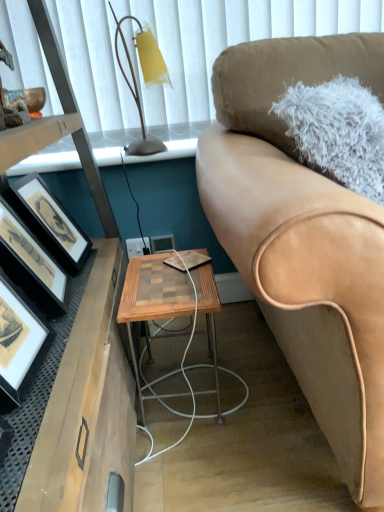
Question: Should I look upward or downward to see woodenmaterial/texturetable at center?

Choices:
 (A) down
 (B) up

Answer: (A)

Question: Should I look upward or downward to see matte black picture frame at left, which appears as the first picture frame when viewed from the left?

Choices:
 (A) down
 (B) up

Answer: (B)

Question: Is tan leather couch at right a part of wooden desk at left?

Choices:
 (A) yes
 (B) no

Answer: (B)

Question: Could you tell me if wooden desk at left is facing tan leather couch at right?

Choices:
 (A) no
 (B) yes

Answer: (B)

Question: Considering the relative positions of wooden desk at left and tan leather couch at right in the image provided, is wooden desk at left to the right of tan leather couch at right from the viewer's perspective?

Choices:
 (A) yes
 (B) no

Answer: (B)

Question: From a real-world perspective, is wooden desk at left physically above tan leather couch at right?

Choices:
 (A) yes
 (B) no

Answer: (B)

Question: Considering the relative sizes of wooden desk at left and tan leather couch at right in the image provided, is wooden desk at left smaller than tan leather couch at right?

Choices:
 (A) no
 (B) yes

Answer: (A)

Question: From the image's perspective, does wooden desk at left appear lower than tan leather couch at right?

Choices:
 (A) no
 (B) yes

Answer: (B)

Question: Is matte yellow glass at upper left wider than matte black picture frame at left, positioned as the second picture frame in right-to-left order?

Choices:
 (A) no
 (B) yes

Answer: (B)

Question: Considering the relative sizes of matte yellow glass at upper left and matte black picture frame at left, the 3th picture frame when ordered from back to front, in the image provided, is matte yellow glass at upper left smaller than matte black picture frame at left, the 3th picture frame when ordered from back to front,?

Choices:
 (A) yes
 (B) no

Answer: (A)

Question: Is matte yellow glass at upper left to the right of matte black picture frame at left, the second picture frame positioned from the left, from the viewer's perspective?

Choices:
 (A) yes
 (B) no

Answer: (A)

Question: From the image's perspective, is matte yellow glass at upper left beneath matte black picture frame at left, the second picture frame positioned from the left?

Choices:
 (A) no
 (B) yes

Answer: (A)

Question: Is matte yellow glass at upper left looking in the opposite direction of matte black picture frame at left, placed as the first picture frame when sorted from front to back?

Choices:
 (A) yes
 (B) no

Answer: (B)

Question: Is matte black picture frame at left, the second picture frame positioned from the left, completely or partially inside matte yellow glass at upper left?

Choices:
 (A) no
 (B) yes

Answer: (A)

Question: Does tan leather couch at right have a smaller size compared to wooden desk at left?

Choices:
 (A) no
 (B) yes

Answer: (B)